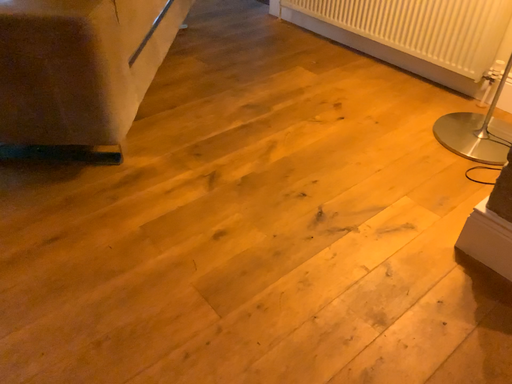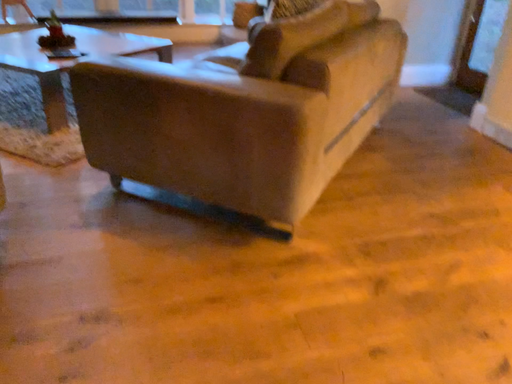
Question: How did the camera likely rotate when shooting the video?

Choices:
 (A) rotated upward
 (B) rotated downward

Answer: (A)